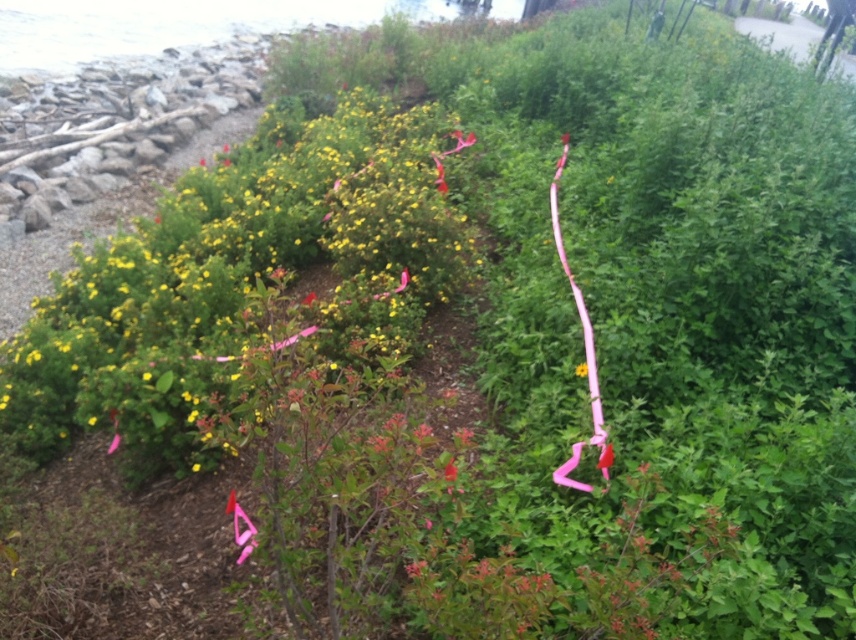
Where is `yellow matte flower at center-left`? yellow matte flower at center-left is located at coordinates (241, 280).

In the scene shown: Does yellow matte flower at center-left appear on the left side of pink silky ribbon at center-right?

Correct, you'll find yellow matte flower at center-left to the left of pink silky ribbon at center-right.

Is point (375, 326) behind point (603, 474)?

Yes.

You are a GUI agent. You are given a task and a screenshot of the screen. Output one action in this format:
    pyautogui.click(x=<x>, y=<y>)
    Task: Click on the yellow matte flower at center-left
    
    Given the screenshot: What is the action you would take?
    pyautogui.click(x=241, y=280)